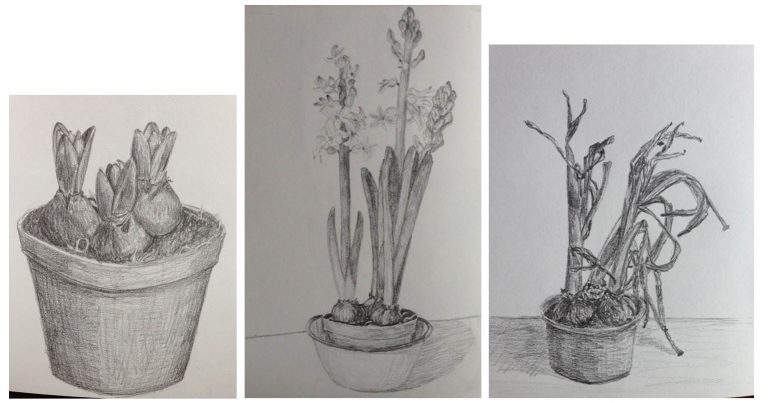
Locate an element on the screen. The height and width of the screenshot is (403, 768). small box is located at coordinates (199, 138).